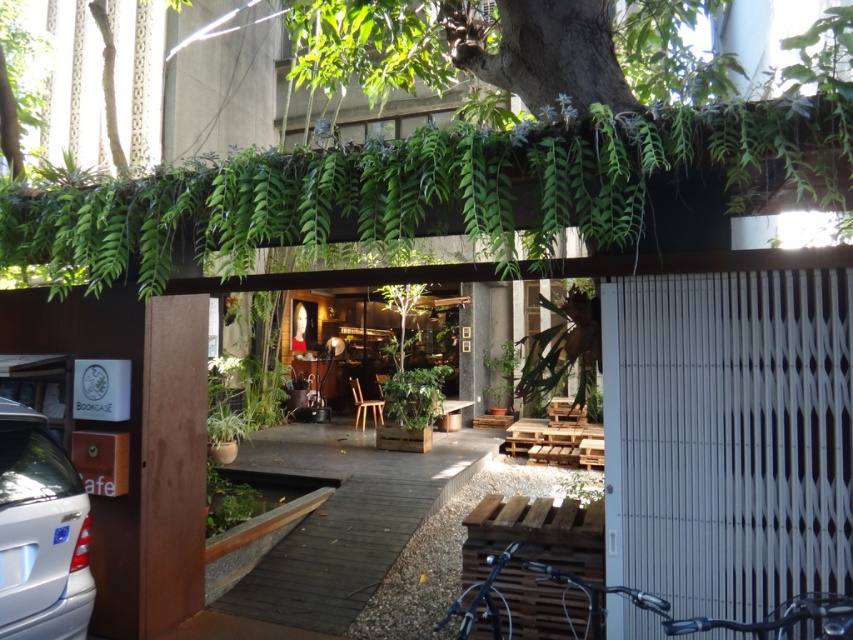
You are a delivery person arriving at the outdoor cafe and need to park your vehicle. You have a silver metallic car at lower left and a shiny black bicycle at lower center available. Which vehicle would require less space to park?

The silver metallic car at lower left has a smaller size compared to the shiny black bicycle at lower center, so it would require less space to park.

You are standing at the entrance of the outdoor cafe and want to walk towards the point at the bottom right corner where the bicycle is parked. You notice two points marked in the image. Which point, point at (523,572) or point at (825,605), is closer to your current position at the entrance?

Point at (825,605) is closer to your current position at the entrance because it is in front of point at (523,572).